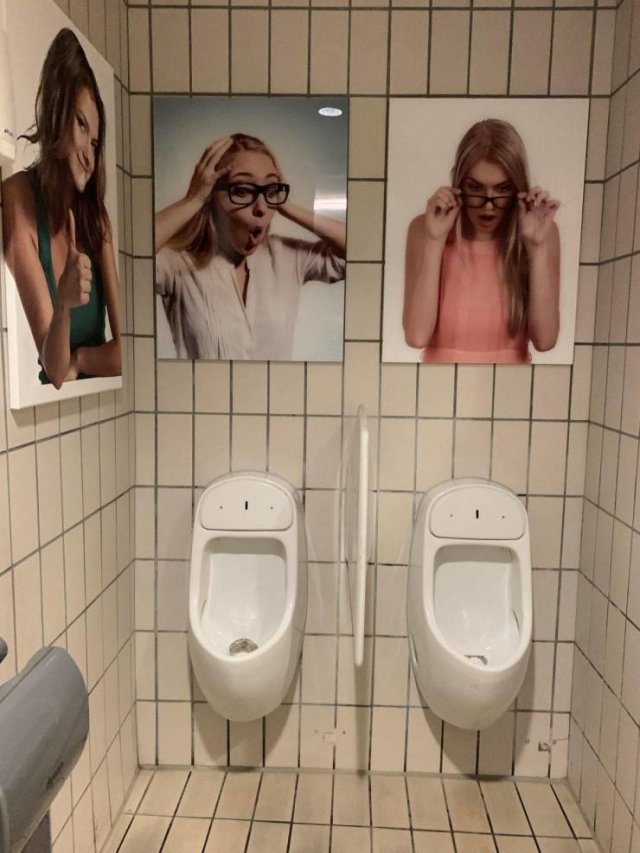
Where is `tile under urinals`? The width and height of the screenshot is (640, 853). tile under urinals is located at coordinates (196, 780), (236, 787), (274, 786), (429, 797), (461, 802), (505, 799).